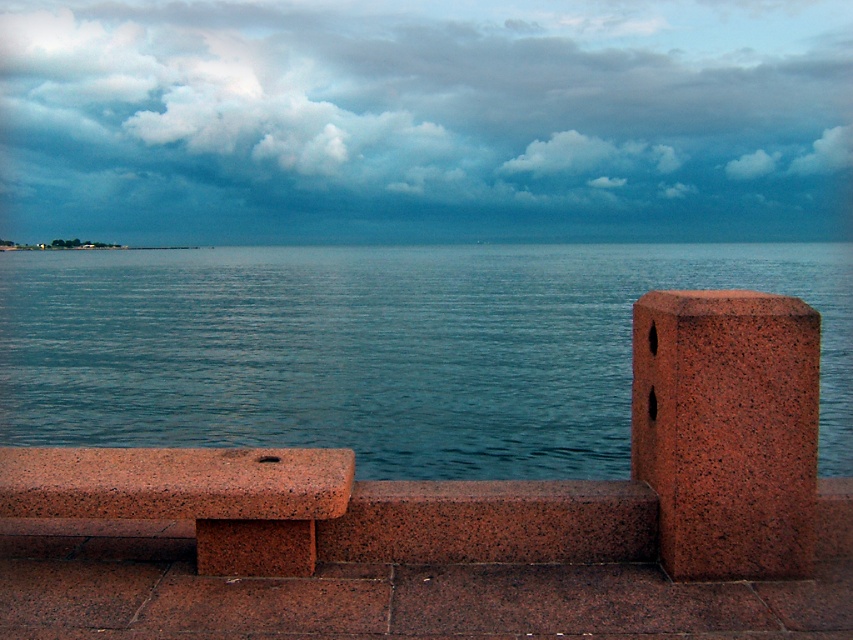
Which of these two, granite at right or granite bench at left, stands shorter?

With less height is granite bench at left.

Does point (735, 320) come behind point (161, 480)?

No, (735, 320) is in front of (161, 480).

At what (x,y) coordinates should I click in order to perform the action: click on granite at right. Please return your answer as a coordinate pair (x, y). This screenshot has width=853, height=640. Looking at the image, I should click on (727, 429).

Does cloudy sky at upper center have a lesser width compared to granite bench at left?

No.

Can you confirm if cloudy sky at upper center is positioned to the left of granite bench at left?

No, cloudy sky at upper center is not to the left of granite bench at left.

Which is behind, point (189, 202) or point (287, 461)?

Positioned behind is point (189, 202).

What are the coordinates of `cloudy sky at upper center` in the screenshot? It's located at (424, 106).

Is cloudy sky at upper center bigger than blue water at center?

No.

The image size is (853, 640). Find the location of `cloudy sky at upper center`. cloudy sky at upper center is located at coordinates click(424, 106).